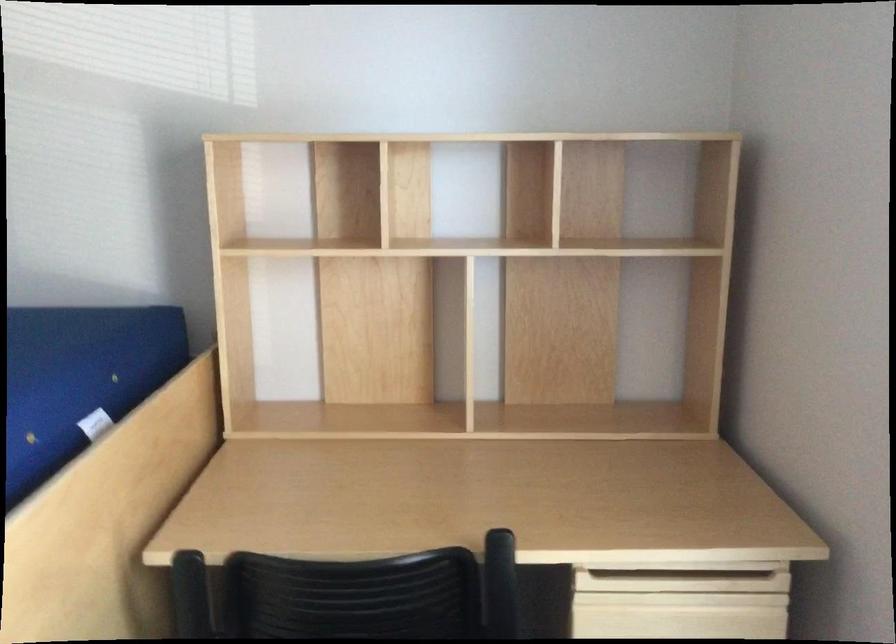
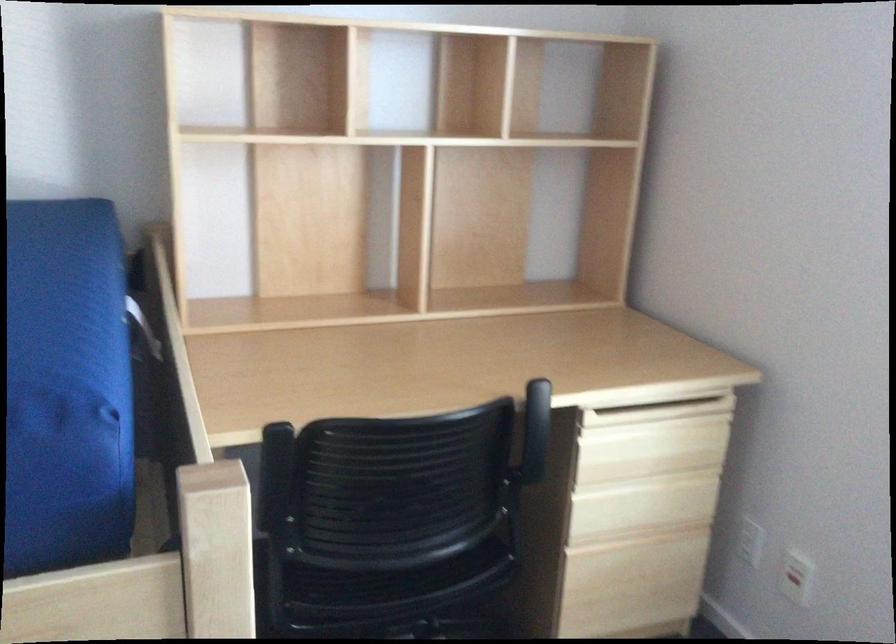
Question: The images are taken continuously from a first-person perspective. In which direction is your viewpoint rotating?

Choices:
 (A) Left
 (B) Right
 (C) Up
 (D) Down

Answer: (B)